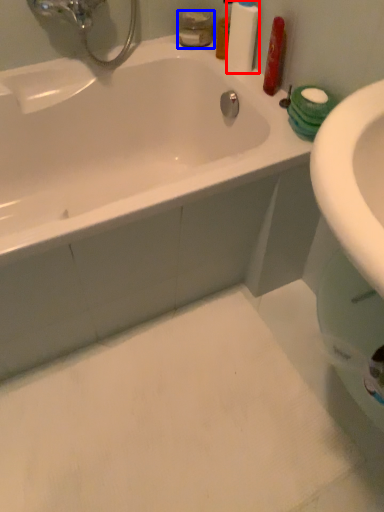
Question: Among these objects, which one is farthest to the camera, cleaning product (highlighted by a red box) or mouthwash (highlighted by a blue box)?

Choices:
 (A) cleaning product
 (B) mouthwash

Answer: (B)